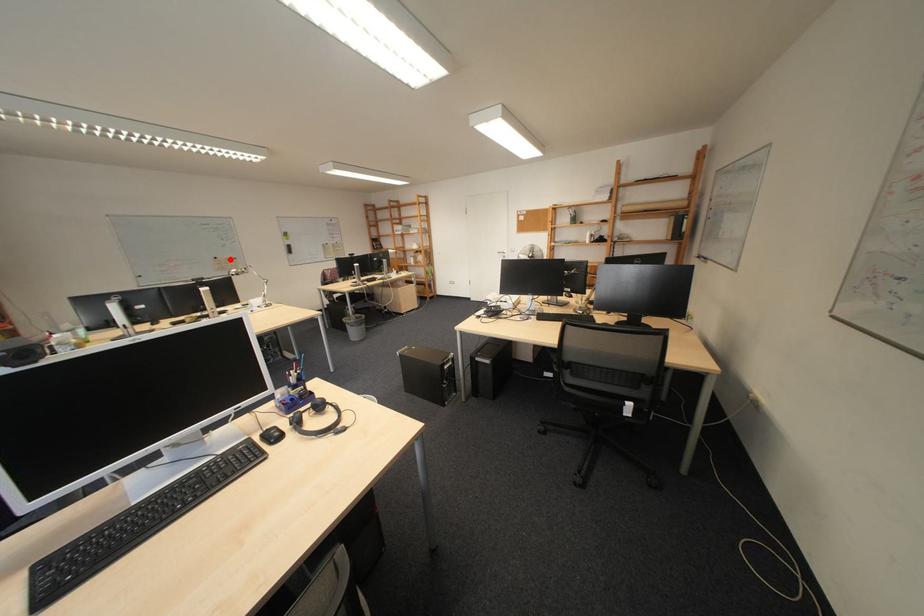
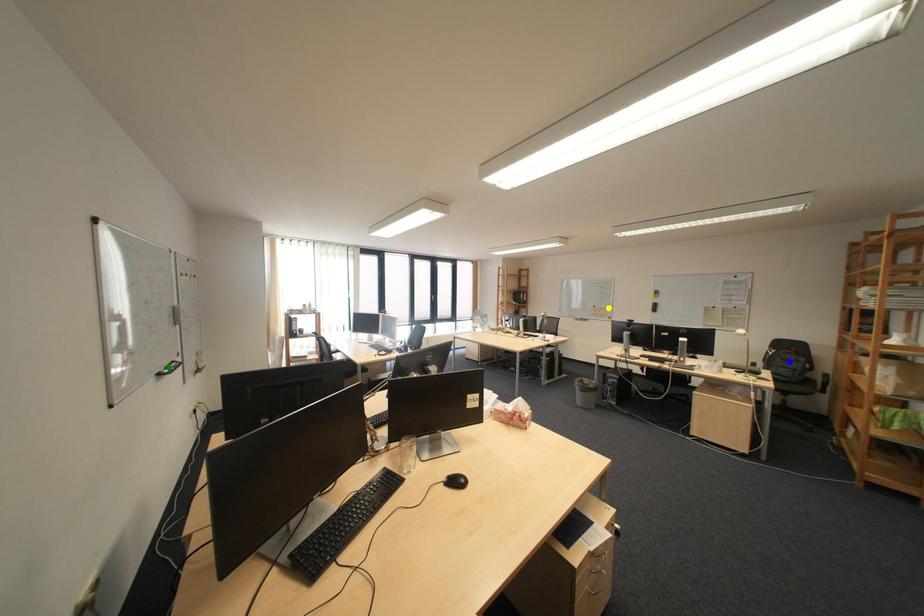
Question: I am providing you with two images of the same scene from different viewpoints. A red point is marked on the first image. You are given multiple points on the second image. In image 2, which mark is for the same physical point as the one in image 1?

Choices:
 (A) blue point
 (B) yellow point
 (C) green point

Answer: (B)